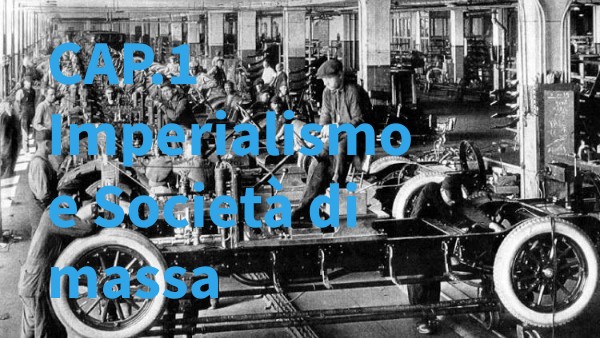
Identify the location of back wall. This screenshot has height=338, width=600. (77, 25).